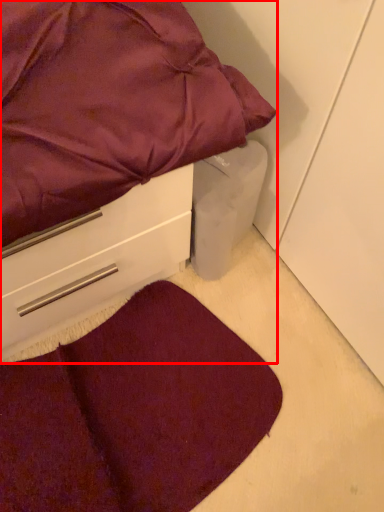
Question: From the image's perspective, considering the relative positions of bed (annotated by the red box) and mat in the image provided, where is bed (annotated by the red box) located with respect to the staircase?

Choices:
 (A) below
 (B) above

Answer: (B)